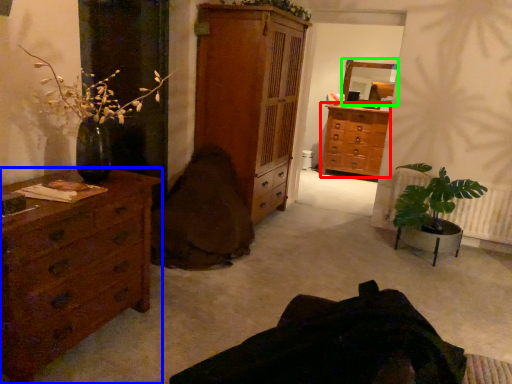
Question: Estimate the real-world distances between objects in this image. Which object is farther from chest of drawers (highlighted by a red box), chest of drawers (highlighted by a blue box) or mirror (highlighted by a green box)?

Choices:
 (A) chest of drawers
 (B) mirror

Answer: (A)